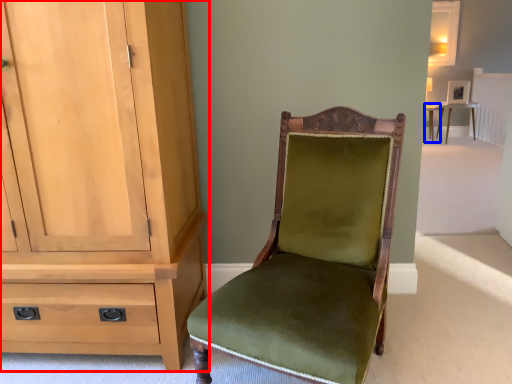
Question: Among these objects, which one is nearest to the camera, cabinetry (highlighted by a red box) or table (highlighted by a blue box)?

Choices:
 (A) cabinetry
 (B) table

Answer: (A)